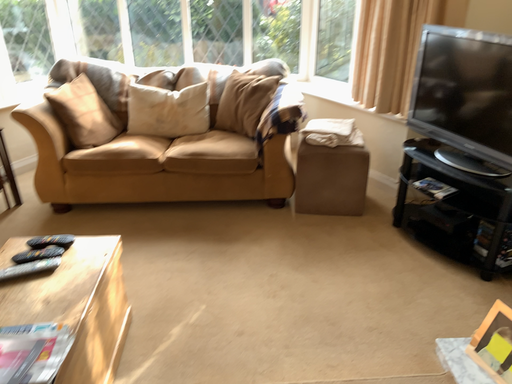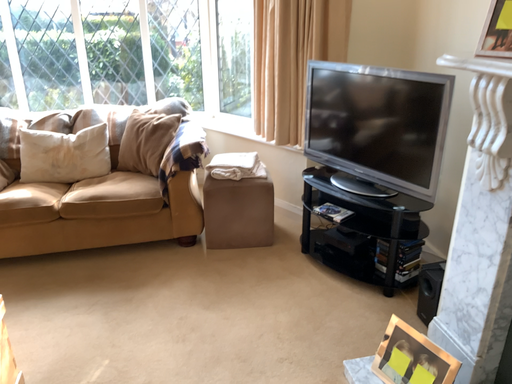
Question: How did the camera likely rotate when shooting the video?

Choices:
 (A) rotated left
 (B) rotated right

Answer: (B)